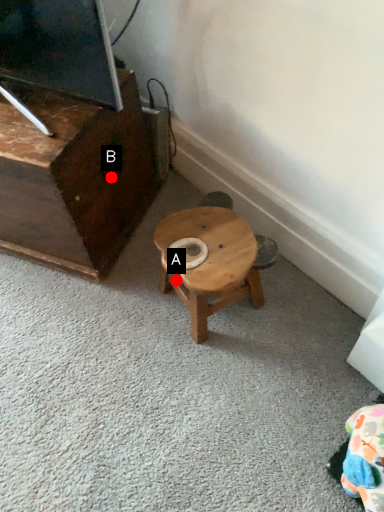
Question: Two points are circled on the image, labeled by A and B beside each circle. Which point is further to the camera?

Choices:
 (A) A is further
 (B) B is further

Answer: (B)